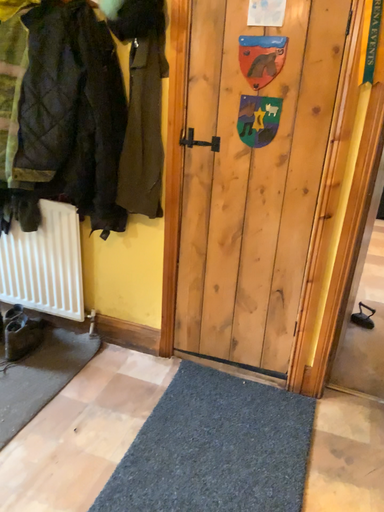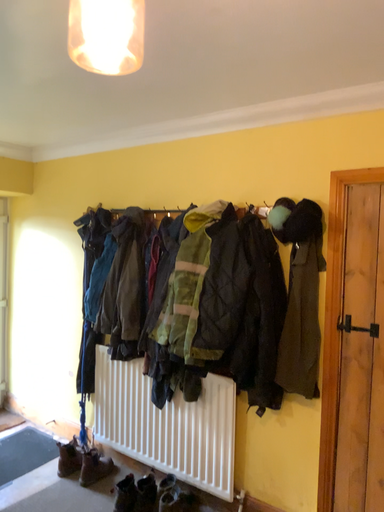
Question: How did the camera likely rotate when shooting the video?

Choices:
 (A) rotated downward
 (B) rotated upward

Answer: (B)